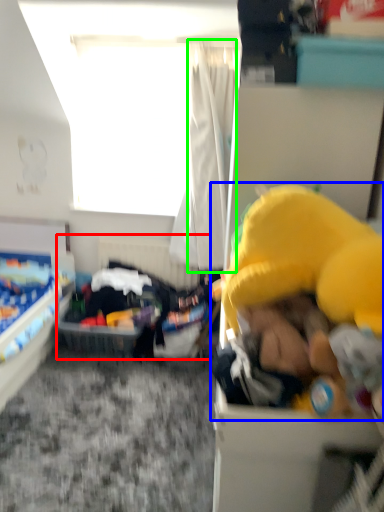
Question: Which is nearer to the infant bed (highlighted by a red box)? toy (highlighted by a blue box) or curtain (highlighted by a green box).

Choices:
 (A) toy
 (B) curtain

Answer: (B)